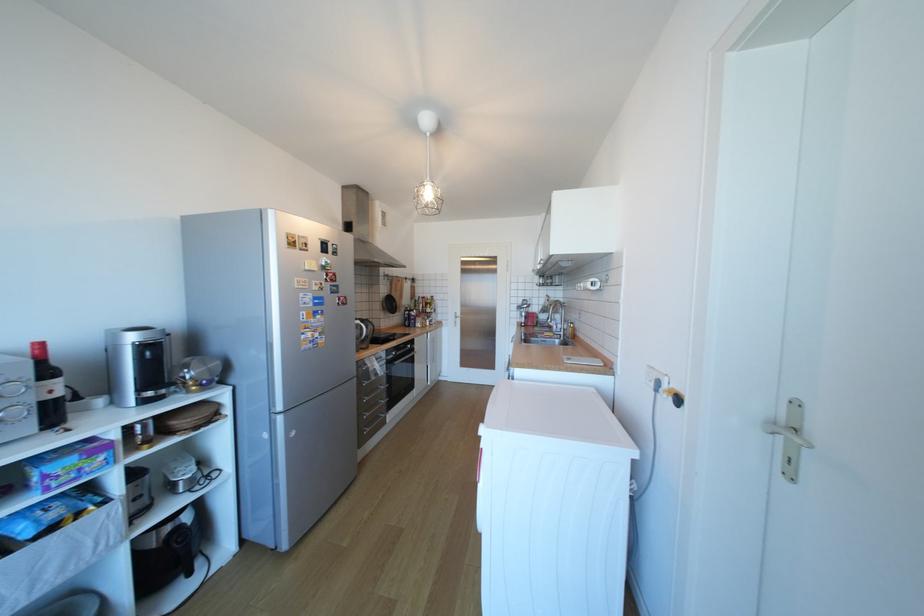
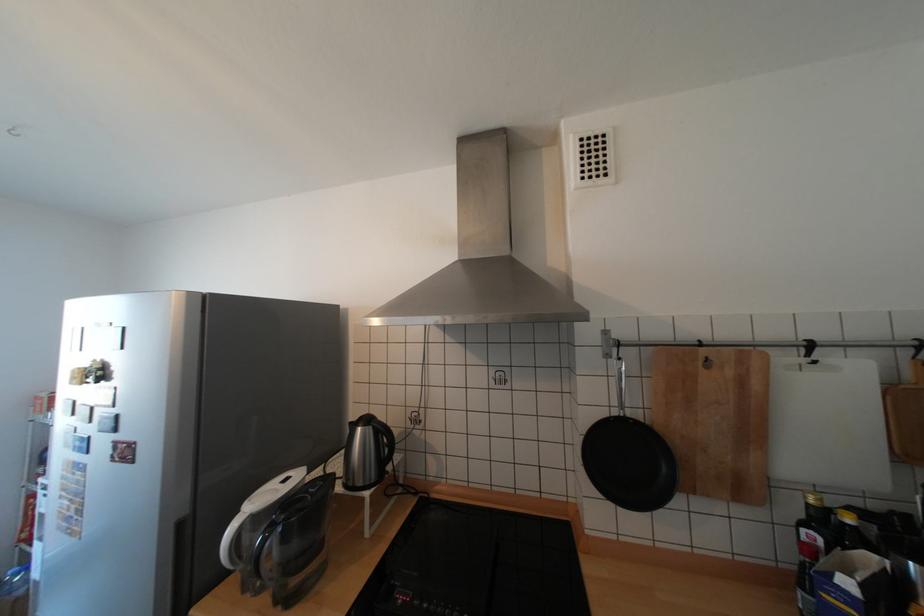
Where in the second image is the point corresponding to point 350,301 from the first image?

(128, 451)